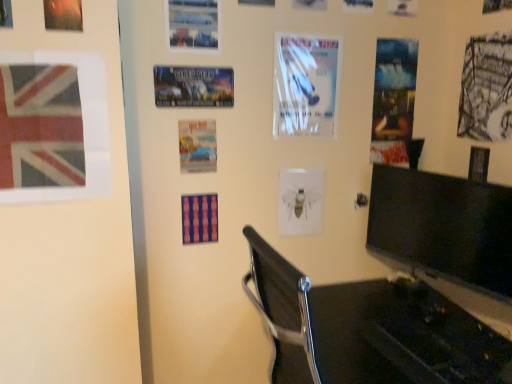
What are the coordinates of `matte striped poster at center, placed as the 4th poster page when sorted from front to back` in the screenshot? It's located at (199, 218).

Measure the distance between point (320,381) and camera.

A distance of 1.26 meters exists between point (320,381) and camera.

In order to face black plastic chair at lower center, should I rotate leftwards or rightwards?

Turn right approximately 17.219 degrees to face it.

The image size is (512, 384). Describe the element at coordinates (403, 8) in the screenshot. I see `white glossy poster at upper center, the sixth poster page viewed from the front` at that location.

How much space does white glossy poster at upper center, acting as the fourth poster starting from the bottom, occupy vertically?

The height of white glossy poster at upper center, acting as the fourth poster starting from the bottom, is 16.78 inches.

Find the location of `grayscale sketch at upper right, arranged as the seventh poster page when viewed from the left`. grayscale sketch at upper right, arranged as the seventh poster page when viewed from the left is located at coordinates (486, 89).

Where is `matte striped poster at center, placed as the 4th poster page when sorted from front to back`? The width and height of the screenshot is (512, 384). matte striped poster at center, placed as the 4th poster page when sorted from front to back is located at coordinates (199, 218).

Is matte striped poster at center, which is counted as the third poster page, starting from the left, wider or thinner than matte paper poster at center, the fourth poster positioned from the top?

matte striped poster at center, which is counted as the third poster page, starting from the left, is wider than matte paper poster at center, the fourth poster positioned from the top.

Considering the relative sizes of matte striped poster at center, which is counted as the fourth poster page, starting from the back, and matte paper poster at center, the 2th poster positioned from the bottom, in the image provided, is matte striped poster at center, which is counted as the fourth poster page, starting from the back, bigger than matte paper poster at center, the 2th poster positioned from the bottom,?

Correct, matte striped poster at center, which is counted as the fourth poster page, starting from the back, is larger in size than matte paper poster at center, the 2th poster positioned from the bottom.

Image resolution: width=512 pixels, height=384 pixels. I want to click on poster page below the matte paper poster at center, the 2th poster positioned from the bottom (from a real-world perspective), so click(x=199, y=218).

Could you tell me if matte striped poster at center, which is counted as the third poster page, starting from the left, is facing matte paper poster at center, the fourth poster positioned from the top?

No, matte striped poster at center, which is counted as the third poster page, starting from the left, is not oriented towards matte paper poster at center, the fourth poster positioned from the top.

From a real-world perspective, does white glossy poster at upper center, acting as the fourth poster starting from the bottom, stand above black plastic chair at lower center?

Yes.

From the black plastic chair at lower center, count 4th posters backward and point to it. Please provide its 2D coordinates.

[(305, 85)]

Considering the relative sizes of white glossy poster at upper center, acting as the fourth poster starting from the bottom, and black plastic chair at lower center in the image provided, is white glossy poster at upper center, acting as the fourth poster starting from the bottom, shorter than black plastic chair at lower center?

Indeed, white glossy poster at upper center, acting as the fourth poster starting from the bottom, has a lesser height compared to black plastic chair at lower center.

Considering the positions of objects white glossy poster at upper center, acting as the 2th poster starting from the top, and black plastic chair at lower center in the image provided, who is more to the left, white glossy poster at upper center, acting as the 2th poster starting from the top, or black plastic chair at lower center?

Positioned to the left is white glossy poster at upper center, acting as the 2th poster starting from the top.

Looking at this image, between matte paper flag at left, the 7th poster page viewed from the right, and white paper bee at center, which is the 5th poster in top-to-bottom order, which one appears on the right side from the viewer's perspective?

Positioned to the right is white paper bee at center, which is the 5th poster in top-to-bottom order.

Is matte paper flag at left, which is counted as the first poster page, starting from the left, in front of or behind white paper bee at center, which is the 5th poster in top-to-bottom order, in the image?

matte paper flag at left, which is counted as the first poster page, starting from the left, is in front of white paper bee at center, which is the 5th poster in top-to-bottom order.

Which object is wider, matte paper flag at left, the 7th poster page viewed from the right, or white paper bee at center, placed as the first poster when sorted from bottom to top?

With larger width is white paper bee at center, placed as the first poster when sorted from bottom to top.

Is matte paper flag at left, which is the 1th poster page from front to back, next to white paper bee at center, placed as the first poster when sorted from bottom to top?

Answer: matte paper flag at left, which is the 1th poster page from front to back, and white paper bee at center, placed as the first poster when sorted from bottom to top, are not in contact.

Is metallic poster at center, the third poster from the bottom, next to grayscale sketch at upper right, the 3th poster page when ordered from front to back?

metallic poster at center, the third poster from the bottom, and grayscale sketch at upper right, the 3th poster page when ordered from front to back, are not in contact.

Is the depth of metallic poster at center, the third poster from the bottom, less than that of grayscale sketch at upper right, placed as the fifth poster page when sorted from back to front?

No.

Between metallic poster at center, which is counted as the third poster, starting from the top, and grayscale sketch at upper right, arranged as the first poster page when viewed from the right, which one has more height?

grayscale sketch at upper right, arranged as the first poster page when viewed from the right.

Is metallic poster at center, the third poster from the bottom, positioned with its back to grayscale sketch at upper right, arranged as the first poster page when viewed from the right?

No, grayscale sketch at upper right, arranged as the first poster page when viewed from the right, is not at the back of metallic poster at center, the third poster from the bottom.

Is metallic silver airplane at upper center, placed as the 5th poster when sorted from bottom to top, outside of black glossy monitor at right?

Indeed, metallic silver airplane at upper center, placed as the 5th poster when sorted from bottom to top, is completely outside black glossy monitor at right.

From a real-world perspective, is metallic silver airplane at upper center, marked as the first poster in a top-to-bottom arrangement, located beneath black glossy monitor at right?

Incorrect, from a real-world perspective, metallic silver airplane at upper center, marked as the first poster in a top-to-bottom arrangement, is higher than black glossy monitor at right.

In the scene shown: Could you tell me if metallic silver airplane at upper center, marked as the first poster in a top-to-bottom arrangement, is turned towards black glossy monitor at right?

No, metallic silver airplane at upper center, marked as the first poster in a top-to-bottom arrangement, is not oriented towards black glossy monitor at right.

From the image's perspective, does metallic silver airplane at upper center, placed as the 5th poster when sorted from bottom to top, appear lower than black glossy monitor at right?

No.

Is white glossy poster at upper center, which is the 2th poster page from back to front, not close to matte striped poster at center, which is counted as the fourth poster page, starting from the back?

white glossy poster at upper center, which is the 2th poster page from back to front, is far away from matte striped poster at center, which is counted as the fourth poster page, starting from the back.

Can you confirm if white glossy poster at upper center, the sixth poster page viewed from the front, is wider than matte striped poster at center, placed as the 4th poster page when sorted from front to back?

No.

Is white glossy poster at upper center, which is the 2th poster page from back to front, looking in the opposite direction of matte striped poster at center, which appears as the 5th poster page when viewed from the right?

No, white glossy poster at upper center, which is the 2th poster page from back to front, is not facing away from matte striped poster at center, which appears as the 5th poster page when viewed from the right.

Between grayscale sketch at upper right, the 3th poster page when ordered from front to back, and matte paper flag at left, which is counted as the first poster page, starting from the left, which one has larger size?

matte paper flag at left, which is counted as the first poster page, starting from the left, is bigger.

Is grayscale sketch at upper right, the 3th poster page when ordered from front to back, touching matte paper flag at left, which is the 1th poster page from front to back?

No, grayscale sketch at upper right, the 3th poster page when ordered from front to back, is not next to matte paper flag at left, which is the 1th poster page from front to back.

Is grayscale sketch at upper right, arranged as the seventh poster page when viewed from the left, shorter than matte paper flag at left, the 7th poster page viewed from the right?

Incorrect, the height of grayscale sketch at upper right, arranged as the seventh poster page when viewed from the left, does not fall short of that of matte paper flag at left, the 7th poster page viewed from the right.

In order to click on the 2nd poster above the matte striped poster at center, which is counted as the third poster page, starting from the left (from a real-world perspective) in this screenshot , I will do `click(197, 146)`.

In the image, there is a white glossy poster at upper center, acting as the 2th poster starting from the top. Identify the location of furniture below it (from the image's perspective). (368, 330).

Looking at the image, which one is located closer to white glossy poster at upper center, acting as the fourth poster starting from the bottom, metallic poster at center, the third poster from the bottom, or metallic silver poster at upper left, the 2th poster page viewed from the front?

metallic poster at center, the third poster from the bottom, is positioned closer to the anchor white glossy poster at upper center, acting as the fourth poster starting from the bottom.

Considering their positions, is black glossy monitor at right positioned further to black plastic chair at lower center than matte paper poster at center, the fourth poster positioned from the top?

Based on the image, matte paper poster at center, the fourth poster positioned from the top, appears to be further to black plastic chair at lower center.

Consider the image. Estimate the real-world distances between objects in this image. Which object is closer to white glossy poster at upper center, which appears as the 6th poster page when viewed from the left, metallic silver airplane at upper center, marked as the first poster in a top-to-bottom arrangement, or matte paper flag at left, which is the 1th poster page from front to back?

metallic silver airplane at upper center, marked as the first poster in a top-to-bottom arrangement, is closer to white glossy poster at upper center, which appears as the 6th poster page when viewed from the left.

From the image, which object appears to be nearer to matte blue poster at upper right, which ranks as the fifth poster page in left-to-right order, metallic silver airplane at upper center, placed as the 5th poster when sorted from bottom to top, or white glossy poster at upper center, which is the 2th poster page from back to front?

white glossy poster at upper center, which is the 2th poster page from back to front, is closer to matte blue poster at upper right, which ranks as the fifth poster page in left-to-right order.

From the image, which object appears to be farther from grayscale sketch at upper right, the 3th poster page when ordered from front to back, matte paper poster at center, the 2th poster positioned from the bottom, or black plastic chair at lower center?

matte paper poster at center, the 2th poster positioned from the bottom.

Considering their positions, is black glossy monitor at right positioned further to white glossy poster at upper center, which is the 2th poster page from back to front, than white glossy poster at upper center, acting as the 2th poster starting from the top?

black glossy monitor at right is positioned further to the anchor white glossy poster at upper center, which is the 2th poster page from back to front.

When comparing their distances from white glossy poster at upper center, which is counted as the second poster page, starting from the right, does metallic poster at center, the third poster from the bottom, or white paper bee at center, which is the 5th poster in top-to-bottom order, seem further?

metallic poster at center, the third poster from the bottom.

Estimate the real-world distances between objects in this image. Which object is closer to matte paper poster at center, the fourth poster positioned from the top, metallic silver airplane at upper center, placed as the 5th poster when sorted from bottom to top, or matte paper flag at left, which is the 1th poster page from front to back?

metallic silver airplane at upper center, placed as the 5th poster when sorted from bottom to top, is positioned closer to the anchor matte paper poster at center, the fourth poster positioned from the top.

I want to click on computer monitor between metallic silver airplane at upper center, placed as the 5th poster when sorted from bottom to top, and grayscale sketch at upper right, arranged as the first poster page when viewed from the right, so click(x=444, y=228).

Locate an element on the screen. poster page between matte paper flag at left, the 7th poster page viewed from the right, and metallic poster at center, which is counted as the third poster, starting from the top is located at coordinates (63, 15).

Where is `poster between metallic silver poster at upper left, which is the 2th poster page from left to right, and metallic poster at center, which is counted as the third poster, starting from the top, in the front-back direction`? Image resolution: width=512 pixels, height=384 pixels. poster between metallic silver poster at upper left, which is the 2th poster page from left to right, and metallic poster at center, which is counted as the third poster, starting from the top, in the front-back direction is located at coordinates coord(193,24).

Find the location of a particular element. This screenshot has width=512, height=384. poster page between metallic silver airplane at upper center, marked as the first poster in a top-to-bottom arrangement, and matte blue poster at upper right, the 7th poster page viewed from the front, in the horizontal direction is located at coordinates (358, 6).